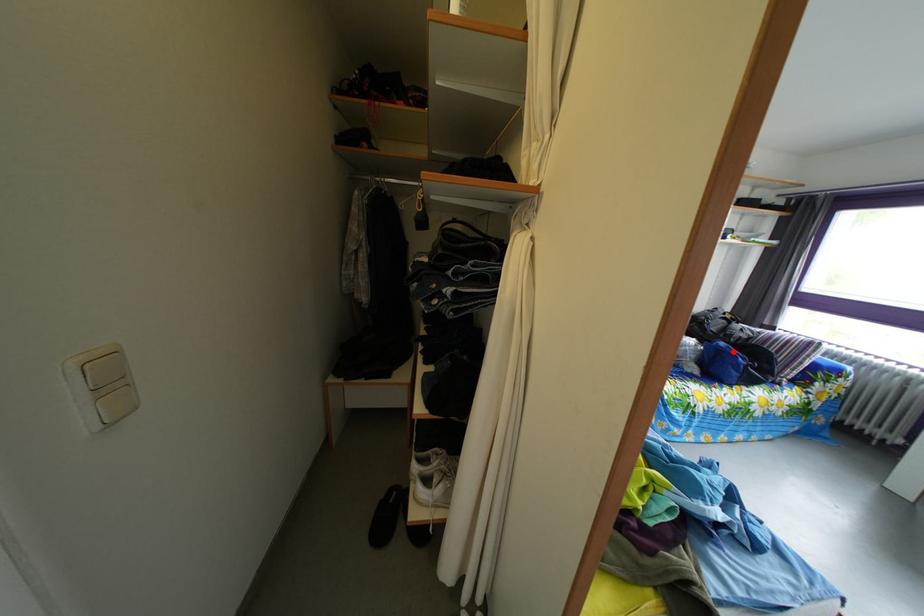
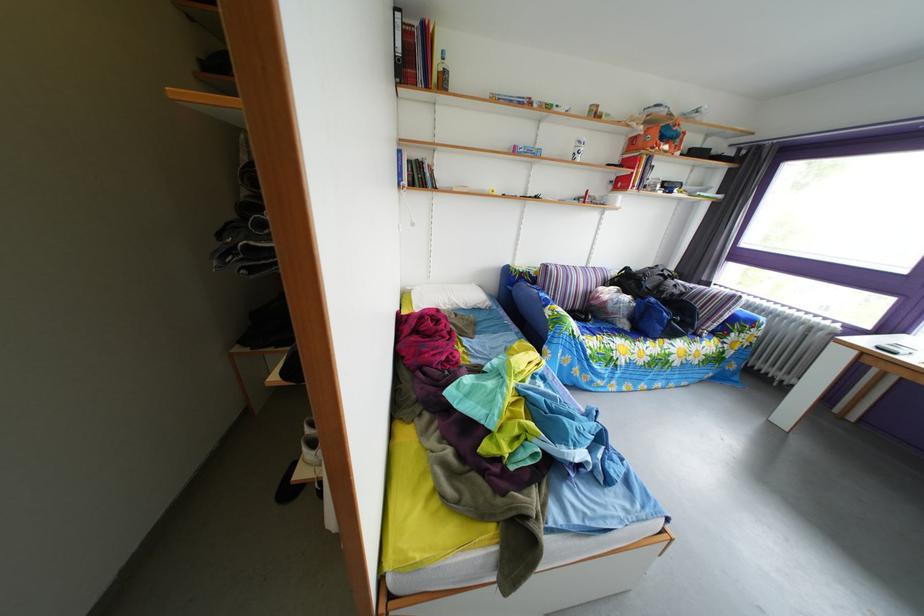
Question: I am providing you with two images of the same scene from different viewpoints. In image1, a red point is highlighted. Considering the same 3D point in image2, which of the following is correct?

Choices:
 (A) It is closer
 (B) It is farther

Answer: (A)